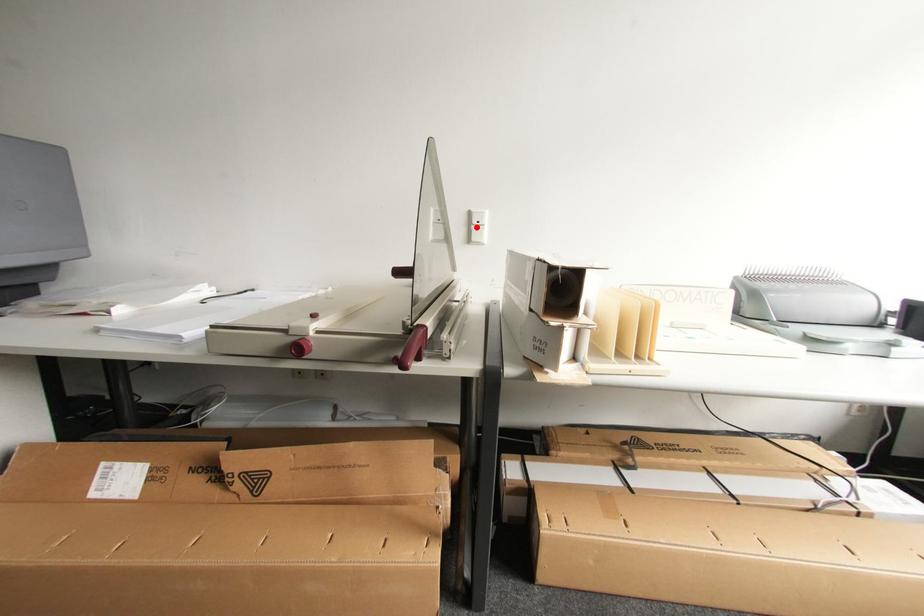
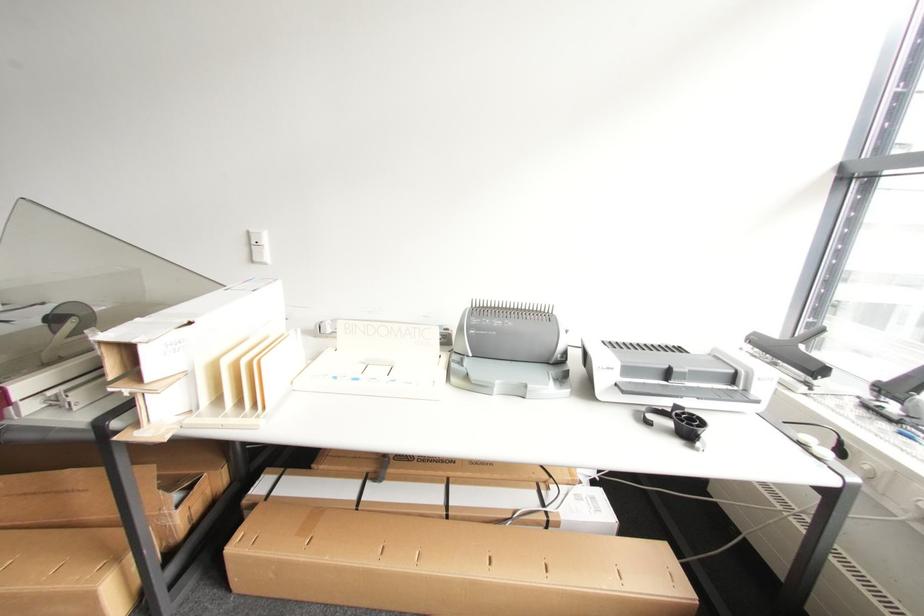
In the second image, find the point that corresponds to the highlighted location in the first image.

(257, 248)